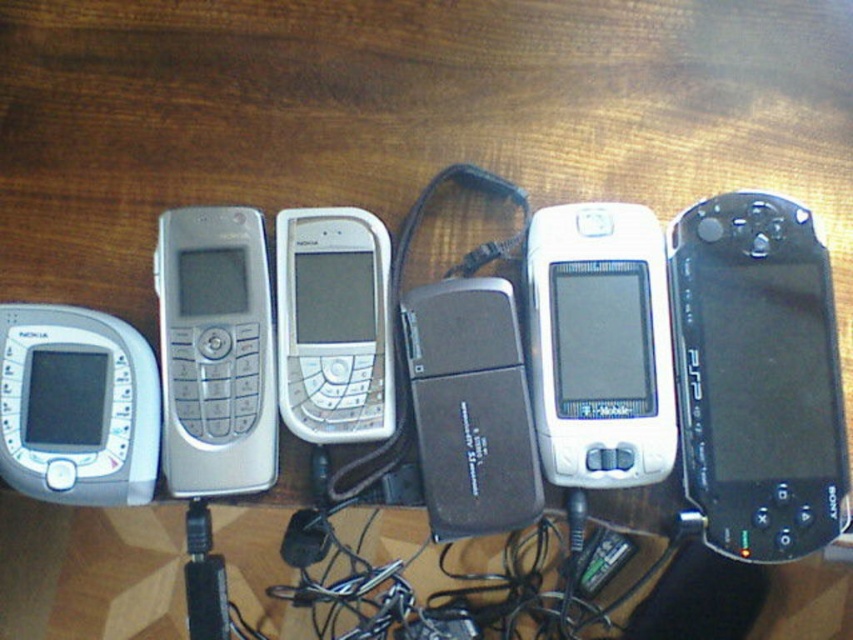
Does silver metallic phone at center-left come behind black plastic usb drive at center?

That is True.

Which is above, silver metallic phone at center-left or black plastic usb drive at center?

Positioned higher is silver metallic phone at center-left.

The width and height of the screenshot is (853, 640). In order to click on silver metallic phone at center-left in this screenshot , I will do `click(215, 353)`.

What are the coordinates of `silver metallic phone at center-left` in the screenshot? It's located at (215, 353).

Does black matte psp at right come behind silver metallic phone at center?

No.

Can you confirm if black matte psp at right is shorter than silver metallic phone at center?

Incorrect, black matte psp at right's height does not fall short of silver metallic phone at center's.

You are a GUI agent. You are given a task and a screenshot of the screen. Output one action in this format:
    pyautogui.click(x=<x>, y=<y>)
    Task: Click on the black matte psp at right
    
    Given the screenshot: What is the action you would take?
    pyautogui.click(x=757, y=378)

You are a GUI agent. You are given a task and a screenshot of the screen. Output one action in this format:
    pyautogui.click(x=<x>, y=<y>)
    Task: Click on the black matte psp at right
    This screenshot has width=853, height=640.
    Given the screenshot: What is the action you would take?
    pyautogui.click(x=757, y=378)

Is black plastic usb drive at center wider than white matte phone at center?

Indeed, black plastic usb drive at center has a greater width compared to white matte phone at center.

Is black plastic usb drive at center further to the viewer compared to white matte phone at center?

No, black plastic usb drive at center is closer to the viewer.

Between point (511, 512) and point (334, 212), which one is positioned behind?

Positioned behind is point (334, 212).

Locate an element on the screen. The image size is (853, 640). black plastic usb drive at center is located at coordinates (469, 406).